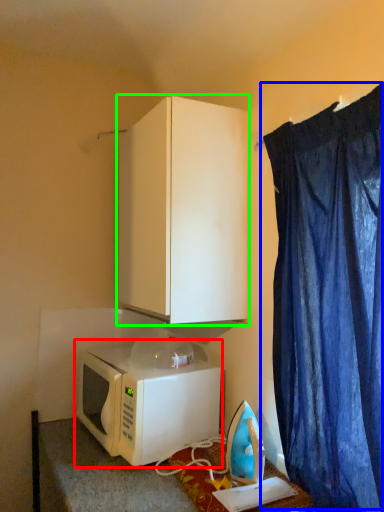
Question: Considering the real-world distances, which object is farthest from microwave oven (highlighted by a red box)? curtain (highlighted by a blue box) or cabinetry (highlighted by a green box)?

Choices:
 (A) curtain
 (B) cabinetry

Answer: (A)